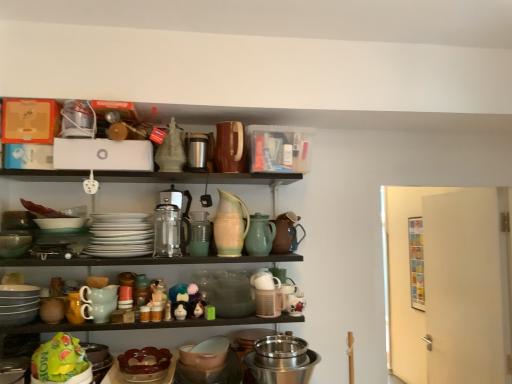
What do you see at coordinates (260, 235) in the screenshot? I see `matte ceramic pitcher at center, which appears as the second tableware when viewed from the right` at bounding box center [260, 235].

What do you see at coordinates (144, 364) in the screenshot? The image size is (512, 384). I see `brown glossy cake stand at lower center, which appears as the fourth tableware when viewed from the left` at bounding box center [144, 364].

What do you see at coordinates (282, 360) in the screenshot?
I see `stainless steel bowl at lower center, the 3th appliance viewed from the left` at bounding box center [282, 360].

Find the location of a particular element. This screenshot has width=512, height=384. stainless steel bowl at lower center, positioned as the 1th appliance in right-to-left order is located at coordinates (282, 360).

The image size is (512, 384). What do you see at coordinates (98, 303) in the screenshot? I see `matte ceramic mugs at center, which is the second tableware from left to right` at bounding box center [98, 303].

The width and height of the screenshot is (512, 384). What are the coordinates of `matte ceramic mugs at center, which is counted as the sixth tableware, starting from the right` in the screenshot? It's located at point(98,303).

Locate an element on the screen. This screenshot has height=384, width=512. white matte teapot at center, which ranks as the 1th tableware in right-to-left order is located at coordinates (264, 280).

Where is `satin silver thermos at upper center, which is counted as the first appliance, starting from the left`? satin silver thermos at upper center, which is counted as the first appliance, starting from the left is located at coordinates (199, 152).

Considering the relative positions of white glossy plates at center, arranged as the third tableware when viewed from the left, and brown glossy cake stand at lower center, which is the fourth tableware from right to left, in the image provided, is white glossy plates at center, arranged as the third tableware when viewed from the left, to the left of brown glossy cake stand at lower center, which is the fourth tableware from right to left, from the viewer's perspective?

Yes.

From a real-world perspective, is white glossy plates at center, arranged as the third tableware when viewed from the left, positioned above or below brown glossy cake stand at lower center, which appears as the fourth tableware when viewed from the left?

Clearly, from a real-world perspective, white glossy plates at center, arranged as the third tableware when viewed from the left, is above brown glossy cake stand at lower center, which appears as the fourth tableware when viewed from the left.

How much distance is there between white glossy plates at center, the fifth tableware in the right-to-left sequence, and brown glossy cake stand at lower center, which appears as the fourth tableware when viewed from the left?

19.63 inches.

Between white glossy plates at center, arranged as the third tableware when viewed from the left, and brown glossy cake stand at lower center, which is the fourth tableware from right to left, which one has more height?

white glossy plates at center, arranged as the third tableware when viewed from the left, is taller.

From a real-world perspective, between speckled ceramic pitcher at center, which appears as the 3th tableware when viewed from the right, and satin silver thermos at upper center, which appears as the third appliance when viewed from the right, who is vertically higher?

From a 3D spatial view, satin silver thermos at upper center, which appears as the third appliance when viewed from the right, is above.

From the image's perspective, which object appears higher, speckled ceramic pitcher at center, the fifth tableware in the left-to-right sequence, or satin silver thermos at upper center, which is the 2th appliance from top to bottom?

satin silver thermos at upper center, which is the 2th appliance from top to bottom, is shown above in the image.

I want to click on the 1st appliance above when counting from the speckled ceramic pitcher at center, the fifth tableware in the left-to-right sequence (from the image's perspective), so click(x=199, y=152).

Can you tell me how much matte ceramic pitcher at center, which appears as the second tableware when viewed from the right, and speckled ceramic pitcher at center, which appears as the 3th tableware when viewed from the right, differ in facing direction?

0.00225 degrees.

From the image's perspective, which one is positioned lower, matte ceramic pitcher at center, the sixth tableware when ordered from left to right, or speckled ceramic pitcher at center, the fifth tableware in the left-to-right sequence?

From the image's view, matte ceramic pitcher at center, the sixth tableware when ordered from left to right, is below.

In the scene shown: Looking at the image, does matte ceramic pitcher at center, which appears as the second tableware when viewed from the right, seem bigger or smaller compared to speckled ceramic pitcher at center, which appears as the 3th tableware when viewed from the right?

In the image, matte ceramic pitcher at center, which appears as the second tableware when viewed from the right, appears to be smaller than speckled ceramic pitcher at center, which appears as the 3th tableware when viewed from the right.

There is a matte ceramic pitcher at center, the sixth tableware when ordered from left to right. What are the coordinates of `the 2nd tableware above it (from a real-world perspective)` in the screenshot? It's located at (230, 225).

Which of these two, matte plastic toy at center, which is counted as the 3th toy, starting from the left, or clear glass coffee maker at center, is smaller?

matte plastic toy at center, which is counted as the 3th toy, starting from the left.

Which object is positioned more to the right, matte plastic toy at center, which is counted as the 3th toy, starting from the left, or clear glass coffee maker at center?

From the viewer's perspective, matte plastic toy at center, which is counted as the 3th toy, starting from the left, appears more on the right side.

From the image's perspective, is matte plastic toy at center, which is counted as the 3th toy, starting from the left, above or below clear glass coffee maker at center?

From the image's perspective, matte plastic toy at center, which is counted as the 3th toy, starting from the left, appears below clear glass coffee maker at center.

From a real-world perspective, is matte plastic toy at center, the 1th toy when ordered from right to left, located higher than clear glass coffee maker at center?

No, from a real-world perspective, matte plastic toy at center, the 1th toy when ordered from right to left, is not on top of clear glass coffee maker at center.

From a real-world perspective, count 1st appliances upward from the brown glossy cake stand at lower center, which is the fourth tableware from right to left, and point to it. Please provide its 2D coordinates.

[(199, 152)]

Is point (202, 152) positioned before point (137, 369)?

No, it is behind (137, 369).

Is brown glossy cake stand at lower center, which appears as the fourth tableware when viewed from the left, inside satin silver thermos at upper center, which is the 2th appliance from top to bottom?

No, brown glossy cake stand at lower center, which appears as the fourth tableware when viewed from the left, is located outside of satin silver thermos at upper center, which is the 2th appliance from top to bottom.

Consider the image. Does satin silver thermos at upper center, which is the 2th appliance from top to bottom, have a greater width compared to brown glossy cake stand at lower center, which is the fourth tableware from right to left?

Incorrect, the width of satin silver thermos at upper center, which is the 2th appliance from top to bottom, does not surpass that of brown glossy cake stand at lower center, which is the fourth tableware from right to left.

Is matte ceramic pitcher at center, which appears as the second tableware when viewed from the right, not near matte white figurine at center, arranged as the second toy when viewed from the left?

No.

Is matte ceramic pitcher at center, the sixth tableware when ordered from left to right, thinner than matte white figurine at center, which is the second toy from right to left?

Yes, matte ceramic pitcher at center, the sixth tableware when ordered from left to right, is thinner than matte white figurine at center, which is the second toy from right to left.

Which object is closer to the camera taking this photo, matte ceramic pitcher at center, which appears as the second tableware when viewed from the right, or matte white figurine at center, which is the second toy from right to left?

matte white figurine at center, which is the second toy from right to left.

Considering the sizes of objects matte ceramic pitcher at center, the sixth tableware when ordered from left to right, and white matte teapot at center, the 7th tableware in the left-to-right sequence, in the image provided, who is wider, matte ceramic pitcher at center, the sixth tableware when ordered from left to right, or white matte teapot at center, the 7th tableware in the left-to-right sequence,?

white matte teapot at center, the 7th tableware in the left-to-right sequence.

From the image's perspective, is matte ceramic pitcher at center, which appears as the second tableware when viewed from the right, above or below white matte teapot at center, the 7th tableware in the left-to-right sequence?

matte ceramic pitcher at center, which appears as the second tableware when viewed from the right, is above white matte teapot at center, the 7th tableware in the left-to-right sequence.

Which tableware is the 1st one when counting from the left side of the white matte teapot at center, the 7th tableware in the left-to-right sequence? Please provide its 2D coordinates.

[(260, 235)]

Consider the image. Who is shorter, matte ceramic pitcher at center, the sixth tableware when ordered from left to right, or white matte teapot at center, the 7th tableware in the left-to-right sequence?

white matte teapot at center, the 7th tableware in the left-to-right sequence, is shorter.

Find the location of `the 5th tableware below the white glossy plates at center, arranged as the third tableware when viewed from the left (from the image's perspective)`. the 5th tableware below the white glossy plates at center, arranged as the third tableware when viewed from the left (from the image's perspective) is located at coordinates (144, 364).

From the satin silver thermos at upper center, which appears as the third appliance when viewed from the right, count 1st tablewares forward and point to it. Please provide its 2D coordinates.

[(230, 225)]

Which object lies nearer to the anchor point matte plastic toy at center, which appears as the 3th toy when viewed from the right, white glossy plates at center, arranged as the third tableware when viewed from the left, or matte ceramic mugs at center, which is the second tableware from left to right?

The object closer to matte plastic toy at center, which appears as the 3th toy when viewed from the right, is matte ceramic mugs at center, which is the second tableware from left to right.

From the image, which object appears to be farther from white matte teapot at center, which ranks as the 1th tableware in right-to-left order, matte gray bowls at lower left, acting as the 7th tableware starting from the right, or brown matte pitcher at upper center, placed as the third appliance when sorted from bottom to top?

matte gray bowls at lower left, acting as the 7th tableware starting from the right, is positioned further to the anchor white matte teapot at center, which ranks as the 1th tableware in right-to-left order.

When comparing their distances from stainless steel bowl at lower center, the 3th appliance viewed from the top, does satin silver thermos at upper center, which appears as the third appliance when viewed from the right, or brown matte pitcher at upper center, the second appliance viewed from the right, seem further?

Based on the image, satin silver thermos at upper center, which appears as the third appliance when viewed from the right, appears to be further to stainless steel bowl at lower center, the 3th appliance viewed from the top.

Based on their spatial positions, is stainless steel bowl at lower center, which ranks as the 1th appliance in bottom-to-top order, or matte gray bowls at lower left, acting as the 7th tableware starting from the right, closer to clear glass coffee maker at center?

matte gray bowls at lower left, acting as the 7th tableware starting from the right, is positioned closer to the anchor clear glass coffee maker at center.

Based on their spatial positions, is matte plastic toy at center, acting as the 1th toy starting from the left, or matte plastic toy at center, which is counted as the 3th toy, starting from the left, further from brown matte pitcher at upper center, the second appliance viewed from the right?

matte plastic toy at center, acting as the 1th toy starting from the left, lies further to brown matte pitcher at upper center, the second appliance viewed from the right, than the other object.

When comparing their distances from speckled ceramic pitcher at center, which appears as the 3th tableware when viewed from the right, does white matte teapot at center, the 7th tableware in the left-to-right sequence, or matte ceramic mugs at center, which is the second tableware from left to right, seem further?

Based on the image, matte ceramic mugs at center, which is the second tableware from left to right, appears to be further to speckled ceramic pitcher at center, which appears as the 3th tableware when viewed from the right.

Estimate the real-world distances between objects in this image. Which object is closer to brown glossy cake stand at lower center, which is the fourth tableware from right to left, brown matte pitcher at upper center, placed as the third appliance when sorted from bottom to top, or matte plastic toy at center, which appears as the 3th toy when viewed from the right?

Among the two, matte plastic toy at center, which appears as the 3th toy when viewed from the right, is located nearer to brown glossy cake stand at lower center, which is the fourth tableware from right to left.

Considering their positions, is white matte teapot at center, which ranks as the 1th tableware in right-to-left order, positioned further to brown glossy cake stand at lower center, which is the fourth tableware from right to left, than brown matte pitcher at upper center, placed as the third appliance when sorted from bottom to top?

brown matte pitcher at upper center, placed as the third appliance when sorted from bottom to top, is positioned further to the anchor brown glossy cake stand at lower center, which is the fourth tableware from right to left.

Where is `toy between brown matte pitcher at upper center, which is counted as the 1th appliance, starting from the top, and matte plastic toy at center, which is counted as the 3th toy, starting from the left, vertically`? toy between brown matte pitcher at upper center, which is counted as the 1th appliance, starting from the top, and matte plastic toy at center, which is counted as the 3th toy, starting from the left, vertically is located at coordinates (157, 300).

Locate an element on the screen. The width and height of the screenshot is (512, 384). coffee machine between matte gray bowls at lower left, acting as the 7th tableware starting from the right, and stainless steel bowl at lower center, the 3th appliance viewed from the left, in the horizontal direction is located at coordinates (170, 224).

In order to click on coffee machine between matte ceramic mugs at center, which is counted as the sixth tableware, starting from the right, and speckled ceramic pitcher at center, which appears as the 3th tableware when viewed from the right in this screenshot , I will do `click(170, 224)`.

Locate an element on the screen. coffee machine between white glossy plates at center, arranged as the third tableware when viewed from the left, and stainless steel bowl at lower center, the 3th appliance viewed from the top, from left to right is located at coordinates [170, 224].